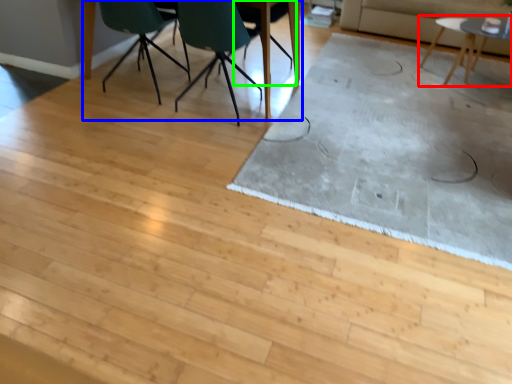
Question: Which object is the farthest from table (highlighted by a red box)? Choose among these: table (highlighted by a blue box) or chair (highlighted by a green box).

Choices:
 (A) table
 (B) chair

Answer: (A)